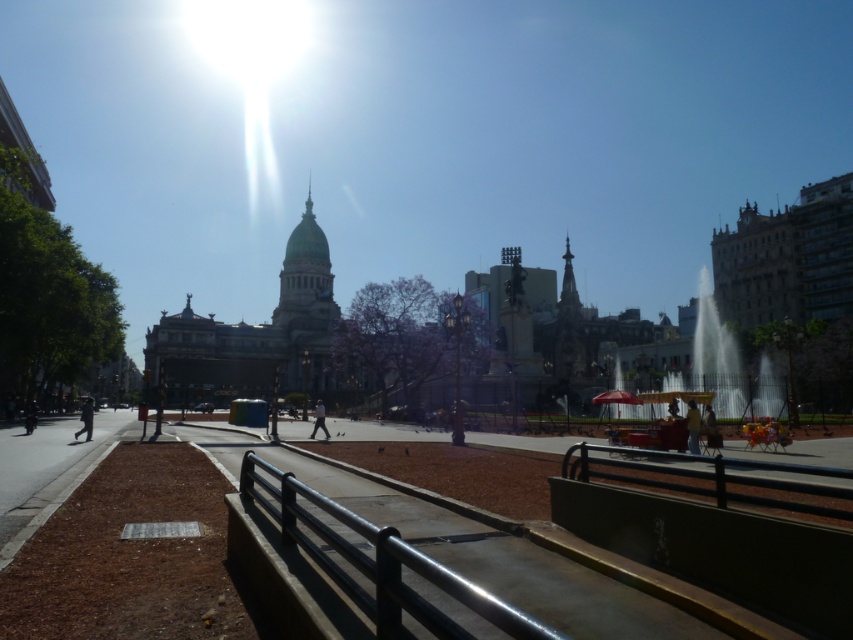
Question: Is metallic fountain at center right below dark gray pants at lower left?

Choices:
 (A) no
 (B) yes

Answer: (A)

Question: Is metallic fountain at center right behind dark gray pants at lower left?

Choices:
 (A) yes
 (B) no

Answer: (B)

Question: Which point appears closest to the camera in this image?

Choices:
 (A) (708, 308)
 (B) (318, 400)
 (C) (697, 452)
 (D) (86, 440)

Answer: (C)

Question: Is metallic fountain at center right closer to the viewer compared to yellow fabric umbrella at center?

Choices:
 (A) yes
 (B) no

Answer: (B)

Question: Considering the real-world distances, which object is farthest from the light blue jeans at center?

Choices:
 (A) yellow fabric umbrella at center
 (B) metallic fountain at center right

Answer: (B)

Question: Which of these objects is positioned farthest from the dark gray pants at lower left?

Choices:
 (A) light blue jeans at center
 (B) yellow fabric umbrella at center

Answer: (B)